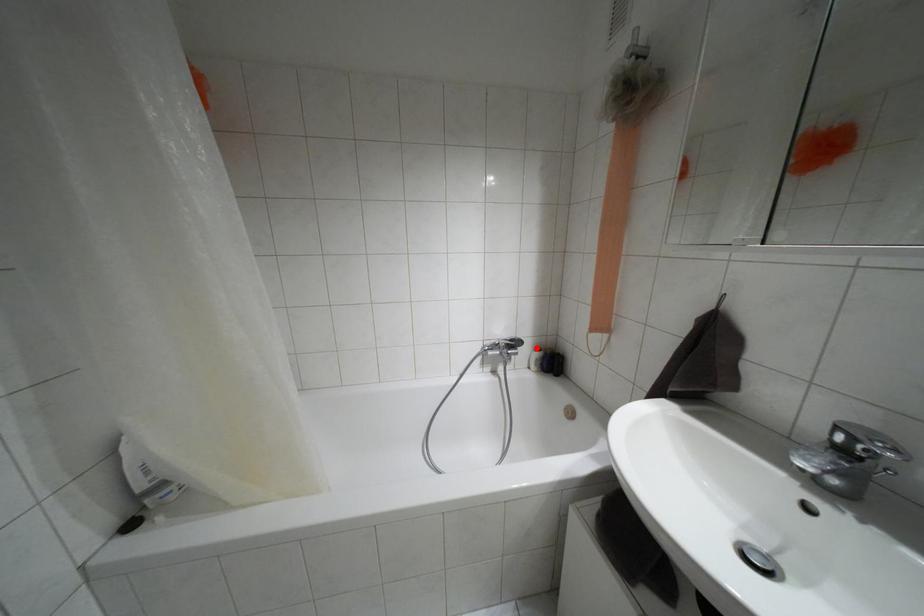
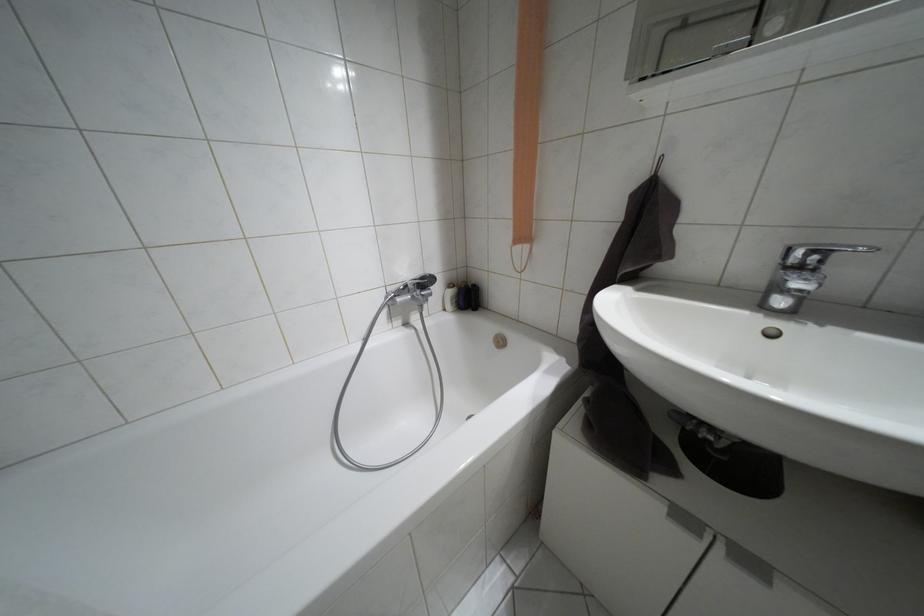
Question: I am providing you with two images of the same scene from different viewpoints. Given a red point in image1, look at the same physical point in image2. Is it:

Choices:
 (A) Closer to the viewpoint
 (B) Farther from the viewpoint

Answer: (A)